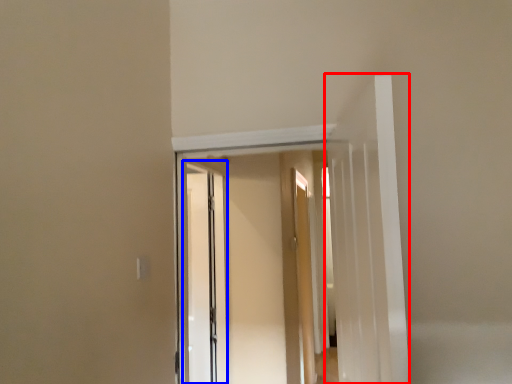
Question: Which of the following is the closest to the observer, door (highlighted by a red box) or screen door (highlighted by a blue box)?

Choices:
 (A) door
 (B) screen door

Answer: (A)